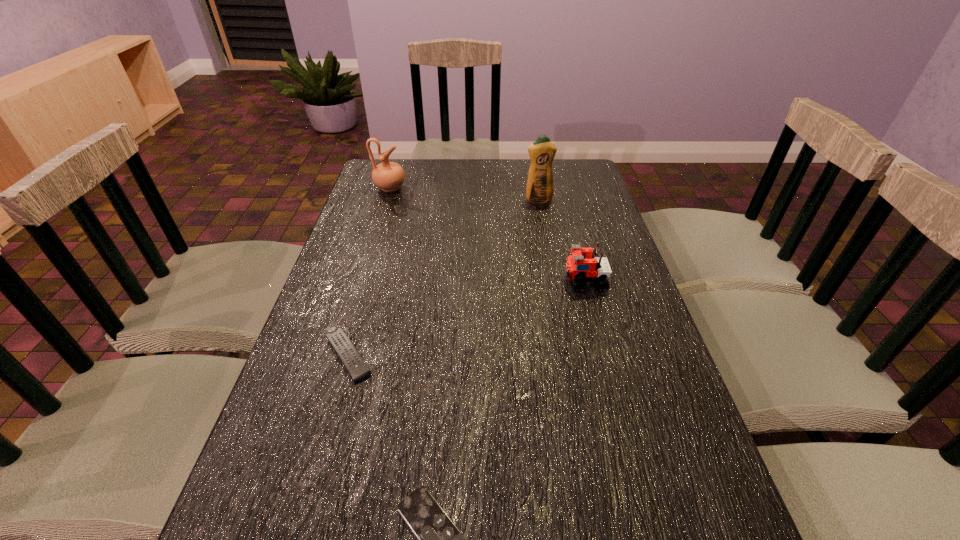
Where is `vacant space situated 0.320m on the front-facing side of the third shortest object`? vacant space situated 0.320m on the front-facing side of the third shortest object is located at coordinates (444, 281).

Identify the location of vacant region located 0.170m on the front-facing side of the third shortest object. The width and height of the screenshot is (960, 540). [500, 281].

The image size is (960, 540). Find the location of `free location located 0.190m on the front-facing side of the third shortest object`. free location located 0.190m on the front-facing side of the third shortest object is located at coordinates (492, 281).

Locate an element on the screen. The height and width of the screenshot is (540, 960). blank area located 0.060m on the right of the taller remote control is located at coordinates (403, 356).

At what (x,y) coordinates should I click in order to perform the action: click on object present at the far edge. Please return your answer as a coordinate pair (x, y). The width and height of the screenshot is (960, 540). Looking at the image, I should click on (389, 176).

Find the location of `pottery situated at the left edge`. pottery situated at the left edge is located at coordinates [x=389, y=176].

Locate an element on the screen. The image size is (960, 540). remote control located at the left edge is located at coordinates 355,365.

Where is `object that is positioned at the right edge`? The height and width of the screenshot is (540, 960). object that is positioned at the right edge is located at coordinates (583, 265).

You are a GUI agent. You are given a task and a screenshot of the screen. Output one action in this format:
    pyautogui.click(x=<x>, y=<y>)
    Task: Click on the object that is at the far left corner
    This screenshot has height=540, width=960.
    Given the screenshot: What is the action you would take?
    pyautogui.click(x=389, y=176)

Image resolution: width=960 pixels, height=540 pixels. What are the coordinates of `free region at the far edge of the desktop` in the screenshot? It's located at (421, 180).